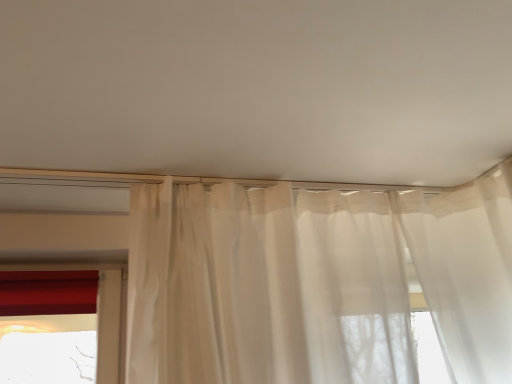
Identify the location of translucent fabric at center. This screenshot has height=384, width=512. (258, 88).

What is the approximate height of translucent fabric at center?

translucent fabric at center is 2.59 inches in height.

The image size is (512, 384). Describe the element at coordinates (258, 88) in the screenshot. I see `translucent fabric at center` at that location.

This screenshot has width=512, height=384. Identify the location of translucent fabric at center. (258, 88).